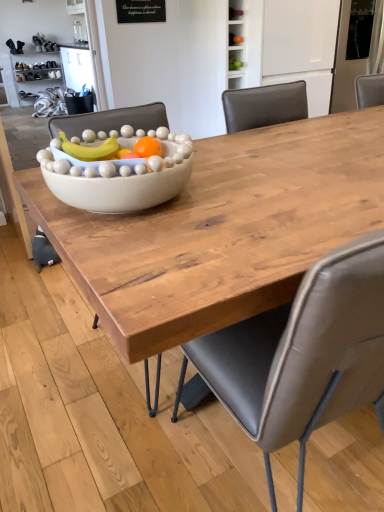
Question: Would you say white glossy bowl at center is to the left or to the right of gray leather chair at center in the picture?

Choices:
 (A) left
 (B) right

Answer: (A)

Question: Considering the positions of white glossy bowl at center and gray leather chair at center in the image, is white glossy bowl at center taller or shorter than gray leather chair at center?

Choices:
 (A) tall
 (B) short

Answer: (B)

Question: Which is nearer to the white glossy bowl at center?

Choices:
 (A) matte wood bowl at center
 (B) gray leather chair at center

Answer: (A)

Question: Which is farther from the matte wood bowl at center?

Choices:
 (A) gray leather chair at center
 (B) white glossy bowl at center

Answer: (A)